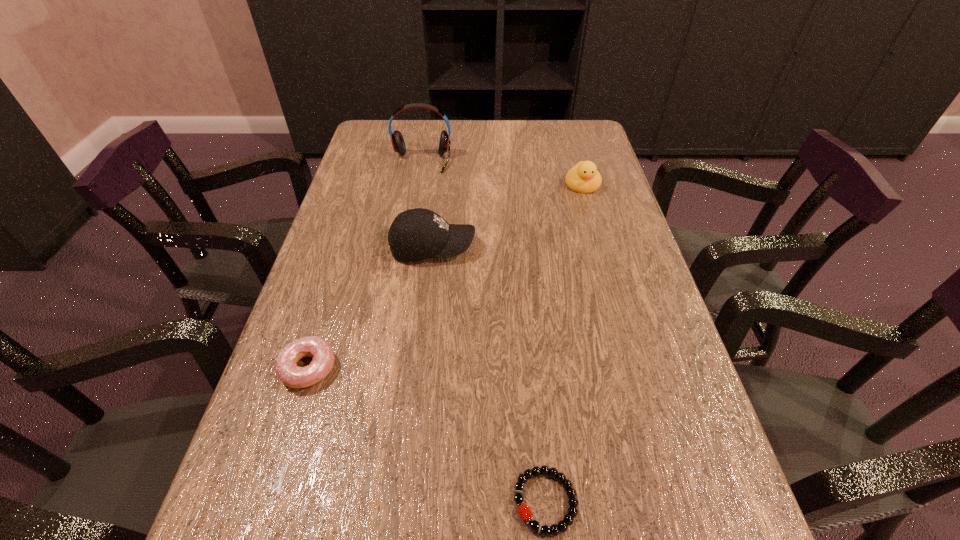
At what (x,y) coordinates should I click in order to perform the action: click on unoccupied area between the fourth object from left to right and the baseball cap. Please return your answer as a coordinate pair (x, y). Image resolution: width=960 pixels, height=540 pixels. Looking at the image, I should click on (489, 374).

Image resolution: width=960 pixels, height=540 pixels. What are the coordinates of `unoccupied area between the nearest object and the fourth nearest object` in the screenshot? It's located at [x=564, y=343].

The image size is (960, 540). In order to click on vacant area that lies between the third farthest object and the fourth farthest object in this screenshot , I will do `click(371, 308)`.

The image size is (960, 540). Identify the location of free space between the fourth farthest object and the shortest object. (427, 435).

At what (x,y) coordinates should I click in order to perform the action: click on object that stands as the third closest to the second farthest object. Please return your answer as a coordinate pair (x, y). Looking at the image, I should click on (293, 376).

Locate which object is the fourth closest to the duckling. Please provide its 2D coordinates. Your answer should be formatted as a tuple, i.e. [(x, y)], where the tuple contains the x and y coordinates of a point satisfying the conditions above.

[(568, 519)]

The height and width of the screenshot is (540, 960). I want to click on vacant space that satisfies the following two spatial constraints: 1. on the front-facing side of the baseball cap; 2. on the front side of the leftmost object, so click(420, 368).

Find the location of a particular element. The width and height of the screenshot is (960, 540). free spot that satisfies the following two spatial constraints: 1. on the front side of the doughnut; 2. on the left side of the nearest object is located at coordinates (267, 501).